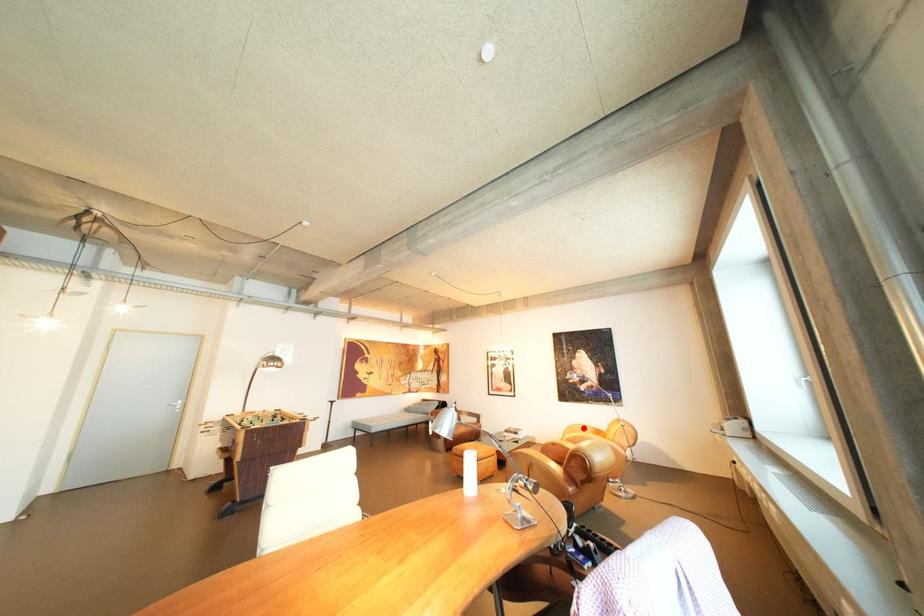
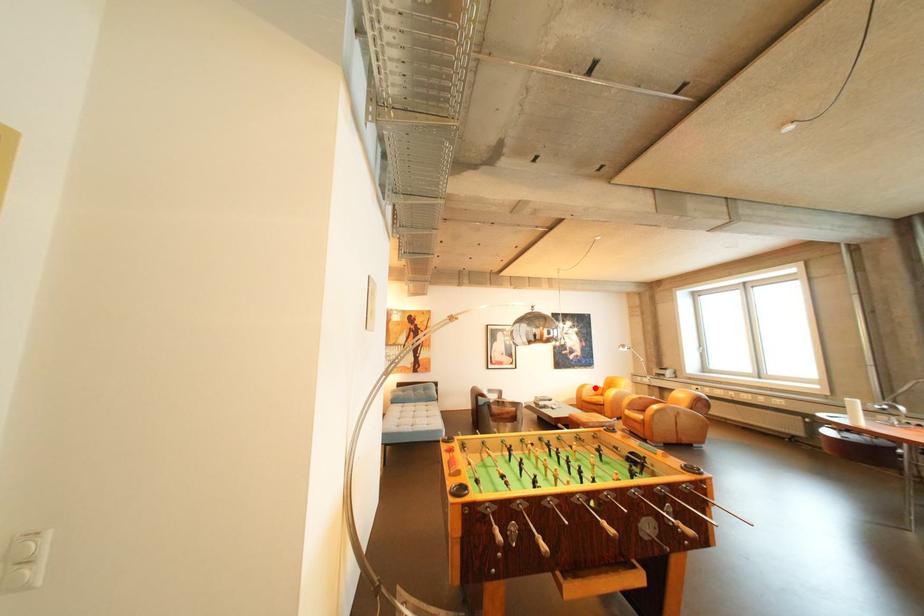
I am providing you with two images of the same scene from different viewpoints. A red point is marked on the first image and another point is marked on the second image. Is the red point in image1 aligned with the point shown in image2?

Yes